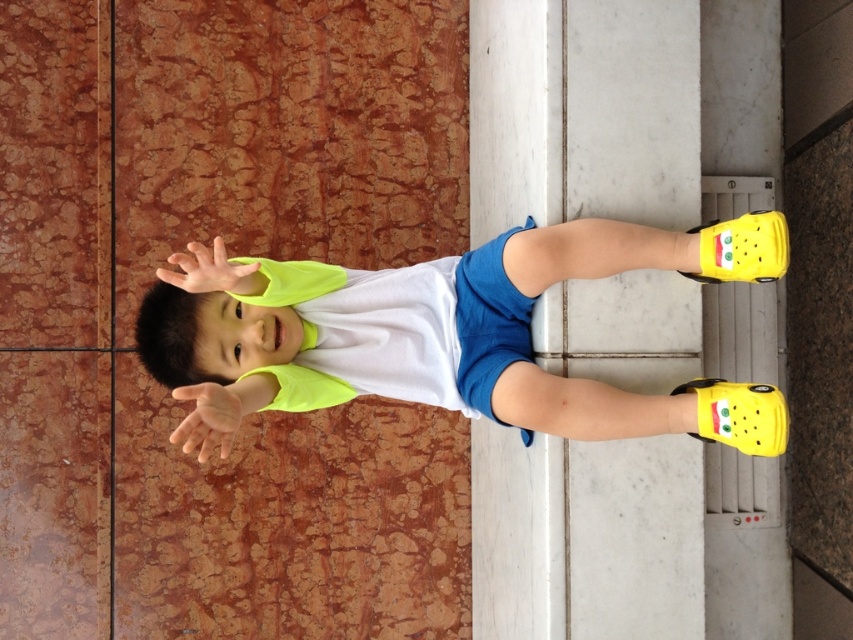
You are a photographer setting up a shot of the white smooth pillar at center and the yellow matte shoes at lower right. To ensure both are in focus, you need to know which object is closer to you. Which one is closer?

The white smooth pillar at center is closer to you than the yellow matte shoes at lower right because it is further to the viewer, meaning it appears nearer in the scene.

You are a photographer setting up a shot of the child in the scene. The child is standing on the tiles, and you need to position a white smooth pillar at center so that it appears in the background without blocking the child. Based on the coordinates provided in the description, can the pillar be placed at its current position to achieve this?

The white smooth pillar at center is located at point (616,108), which likely places it in the background without obstructing the child, so yes, it can be positioned there.